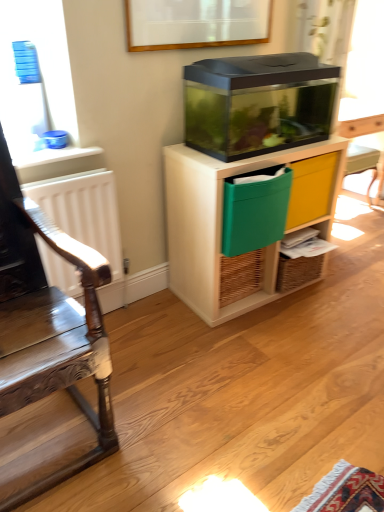
The height and width of the screenshot is (512, 384). What are the coordinates of `empty space that is to the right of wooden polished chair at left` in the screenshot? It's located at (180, 411).